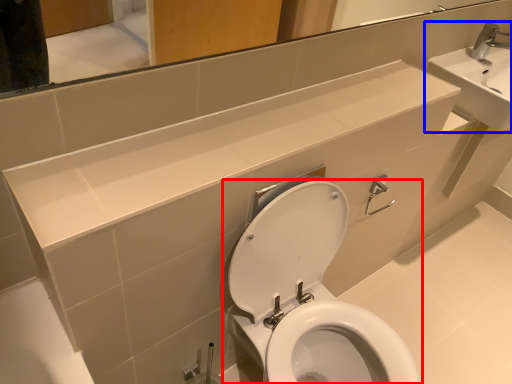
Question: Which point is closer to the camera, toilet (highlighted by a red box) or sink (highlighted by a blue box)?

Choices:
 (A) toilet
 (B) sink

Answer: (A)